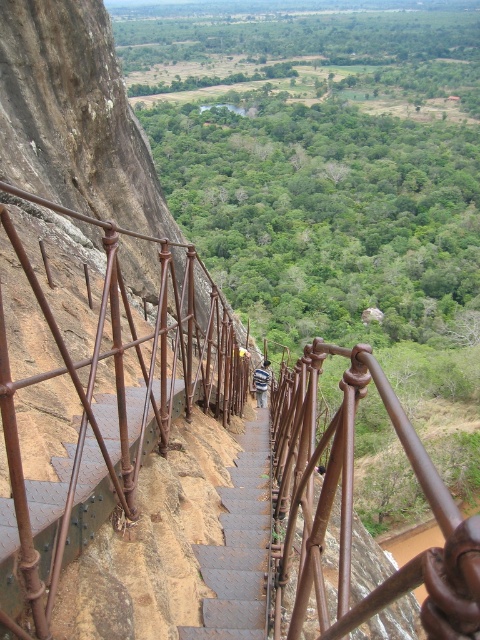
Between rusty metal railing at left and brown textured stairs at center, which one appears on the right side from the viewer's perspective?

From the viewer's perspective, brown textured stairs at center appears more on the right side.

Does rusty metal railing at left appear over brown textured stairs at center?

Correct, rusty metal railing at left is located above brown textured stairs at center.

Is point (19, 246) closer to camera compared to point (230, 552)?

That is True.

The width and height of the screenshot is (480, 640). What are the coordinates of `rusty metal railing at left` in the screenshot? It's located at (108, 408).

Does rusty metal railing at left appear under rusty metal railing at center?

Incorrect, rusty metal railing at left is not positioned below rusty metal railing at center.

Can you confirm if rusty metal railing at left is smaller than rusty metal railing at center?

No, rusty metal railing at left is not smaller than rusty metal railing at center.

Which is behind, point (188, 348) or point (351, 620)?

The point (188, 348) is more distant.

Where is `rusty metal railing at left`? rusty metal railing at left is located at coordinates (108, 408).

From the picture: Does rusty metal railing at center have a greater width compared to brown textured stairs at center?

Correct, the width of rusty metal railing at center exceeds that of brown textured stairs at center.

Between rusty metal railing at center and brown textured stairs at center, which one appears on the left side from the viewer's perspective?

brown textured stairs at center is more to the left.

Where is `rusty metal railing at center`? The height and width of the screenshot is (640, 480). rusty metal railing at center is located at coordinates (351, 508).